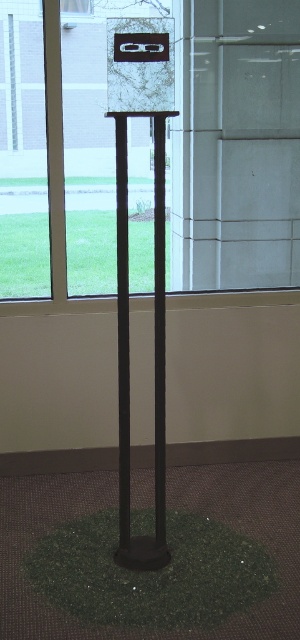
Question: Can you confirm if green grass at lower center is bigger than transparent glass window at upper center?

Choices:
 (A) no
 (B) yes

Answer: (B)

Question: Does green grass at lower center appear on the left side of transparent glass window at upper center?

Choices:
 (A) yes
 (B) no

Answer: (B)

Question: Which of the following is the closest to the observer?

Choices:
 (A) (0, 285)
 (B) (66, 8)

Answer: (B)

Question: Among these objects, which one is nearest to the camera?

Choices:
 (A) transparent glass window at upper center
 (B) green grass at lower center

Answer: (A)

Question: Does green grass at lower center come in front of transparent glass window at upper center?

Choices:
 (A) no
 (B) yes

Answer: (A)